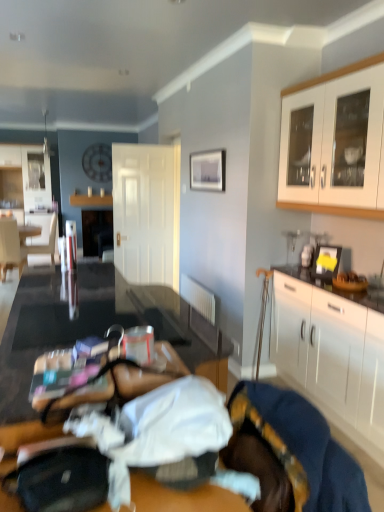
At what (x,y) coordinates should I click in order to perform the action: click on free spot above wooden table at lower left (from a real-world perspective). Please return your answer as a coordinate pair (x, y). The height and width of the screenshot is (512, 384). Looking at the image, I should click on (73, 360).